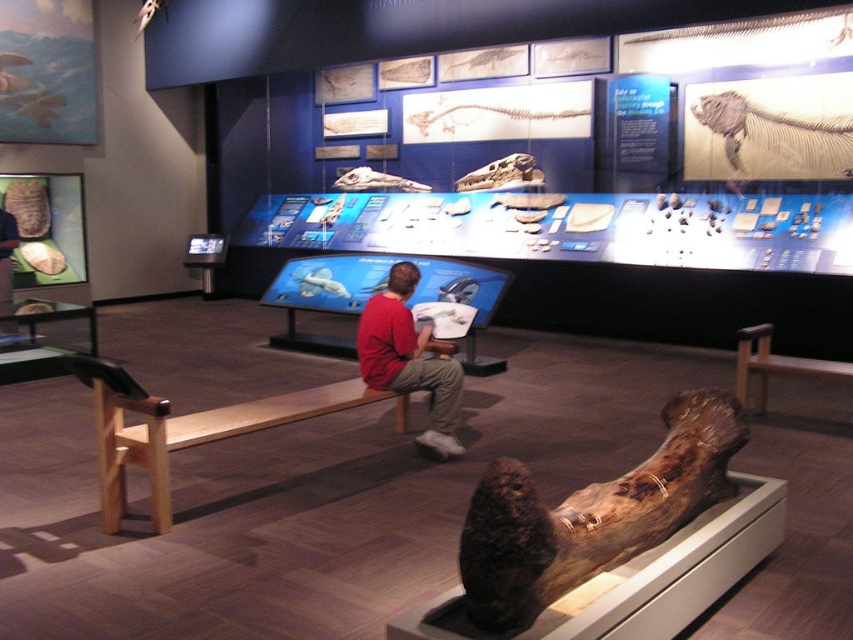
You are a visitor in the museum and want to take a photo of the red cotton shirt at center without the brown wood log at lower right appearing in the frame. Is it possible based on their heights?

The brown wood log at lower right is shorter than the red cotton shirt at center. Since the log is shorter, it might be possible to position the camera so that the log is either out of the frame or obscured by the shirt if the angle allows. However, this depends on the exact positioning and distance between the two objects.

You are standing in the museum exhibit and want to take a photo of the point at coordinates (599,500). Your camera has a focal length of 50mm and you are 7.58 feet away from the point. What is the approximate angle of view required to capture the entire point in your photo?

The point at coordinates (599,500) is 7.58 feet away from the camera. To calculate the angle of view needed, use the formula angle of view equals 2 times the arctangent of the sensor height divided by 2 times the distance. However, since the point is a single coordinate, it might be better to consider the camera orientation and focus directly on the point without needing a wide angle. Alternatively, ensure the camera is positioned such that the point is centered within the frame.

You are a visitor at the museum and want to sit down to read the information panels. There is a light brown wood bench at center and a red cotton shirt at center in the exhibit. Which object should you approach to sit down?

You should approach the light brown wood bench at center because it is a bench designed for sitting, while the red cotton shirt at center is likely an exhibit element or part of a display and not meant for seating.